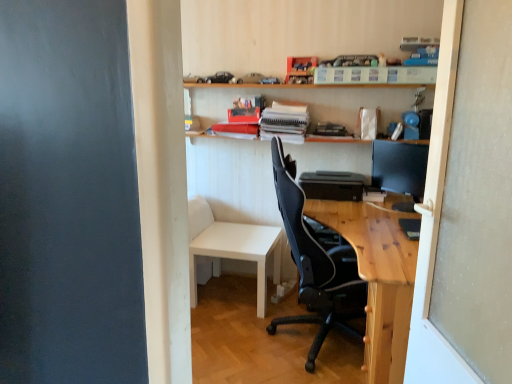
Locate an element on the screen. Image resolution: width=512 pixels, height=384 pixels. free spot above black glossy monitor at upper right (from a real-world perspective) is located at coordinates (405, 144).